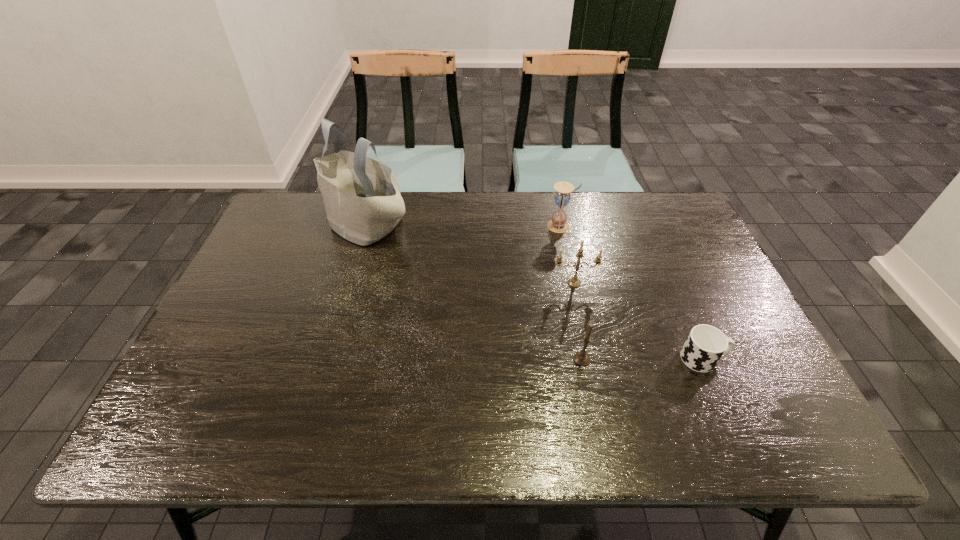
The width and height of the screenshot is (960, 540). Identify the location of free space at the left edge of the desktop. click(x=264, y=279).

In order to click on vacant space at the right edge of the desktop in this screenshot , I will do `click(742, 388)`.

What are the coordinates of `free space at the near left corner of the desktop` in the screenshot? It's located at point(214,416).

Where is `unoccupied position between the nearer candle and the hourglass`? Image resolution: width=960 pixels, height=540 pixels. unoccupied position between the nearer candle and the hourglass is located at coordinates (571, 293).

The image size is (960, 540). Identify the location of vacant region between the nearer candle and the shortest object. (x=642, y=359).

This screenshot has height=540, width=960. Find the location of `unoccupied position between the shorter candle and the hourglass`. unoccupied position between the shorter candle and the hourglass is located at coordinates (571, 293).

This screenshot has height=540, width=960. In order to click on free space between the nearer candle and the leftmost object in this screenshot , I will do `click(474, 291)`.

You are a GUI agent. You are given a task and a screenshot of the screen. Output one action in this format:
    pyautogui.click(x=<x>, y=<y>)
    Task: Click on the vacant space that is in between the hourglass and the shopping bag
    Image resolution: width=960 pixels, height=540 pixels.
    Given the screenshot: What is the action you would take?
    pyautogui.click(x=464, y=224)

The height and width of the screenshot is (540, 960). What are the coordinates of `vacant space that is in between the leftmost object and the farther candle` in the screenshot? It's located at (470, 253).

In order to click on free area in between the fourth tallest object and the hourglass in this screenshot , I will do `click(571, 293)`.